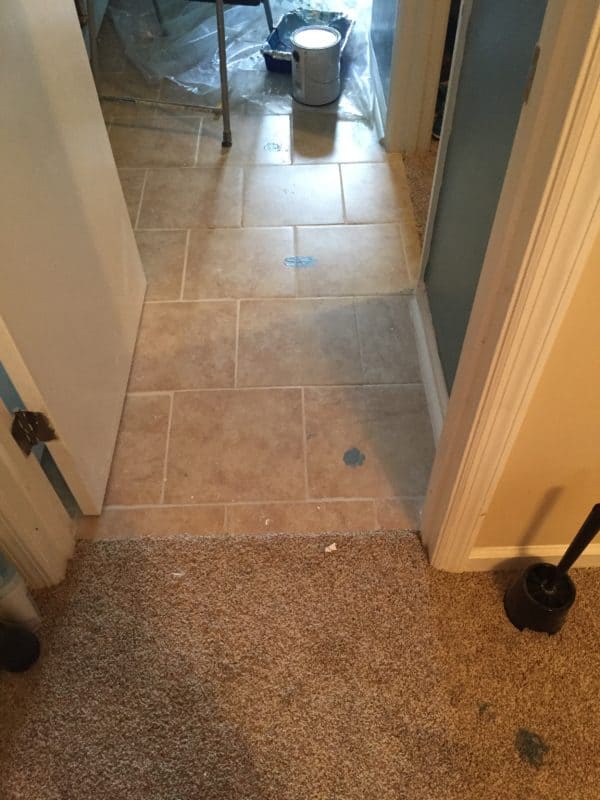
Find the location of `painting area`. painting area is located at coordinates (246, 66).